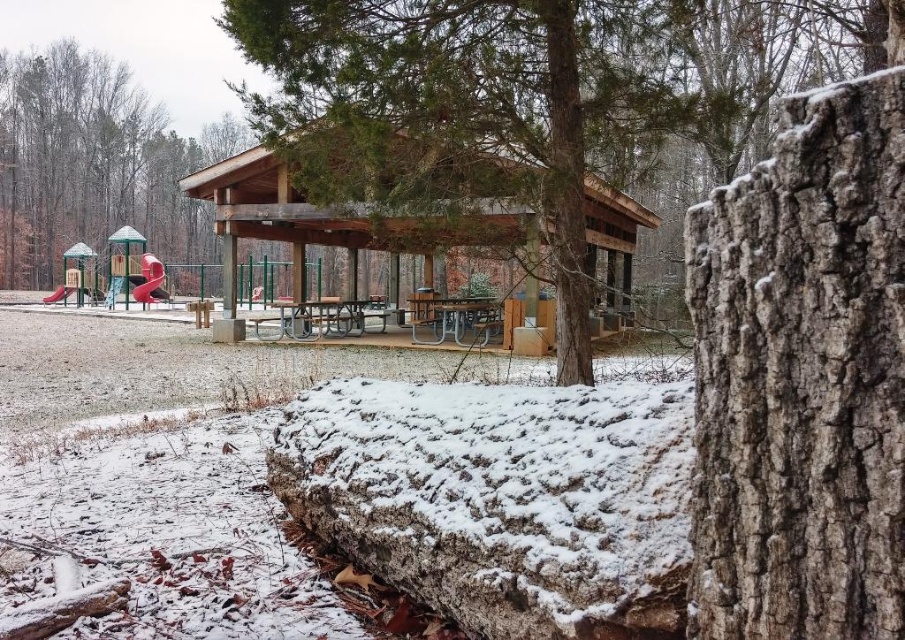
Question: Which point is closer to the camera?

Choices:
 (A) (343, 301)
 (B) (53, 45)
 (C) (660, 67)

Answer: (C)

Question: Is brown rough bark tree at center behind smooth bark tree at upper left?

Choices:
 (A) yes
 (B) no

Answer: (B)

Question: Estimate the real-world distances between objects in this image. Which object is closer to the metallic silver picnic table at center?

Choices:
 (A) smooth bark tree at upper left
 (B) metallic red slide at upper left
 (C) wooden picnic table at center

Answer: (C)

Question: Is brown rough bark tree at center positioned behind metallic silver picnic table at center?

Choices:
 (A) yes
 (B) no

Answer: (B)

Question: Which point is farther from the camera taking this photo?

Choices:
 (A) (205, 195)
 (B) (18, 138)

Answer: (B)

Question: Is smooth bark tree at upper left wider than metallic silver picnic table at center?

Choices:
 (A) no
 (B) yes

Answer: (B)